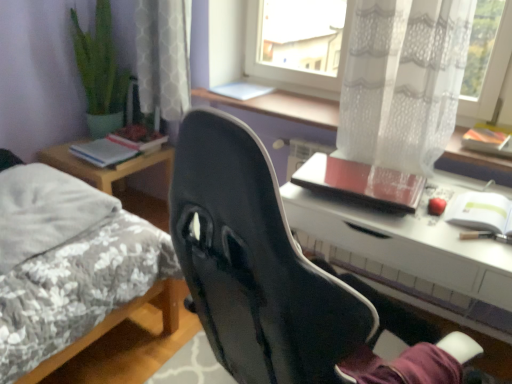
Question: Is point (484, 132) positioned closer to the camera than point (484, 211)?

Choices:
 (A) closer
 (B) farther

Answer: (B)

Question: Considering their positions, is orange matte notebook at upper right, which ranks as the 3th notebook in left-to-right order, located in front of or behind white paper notebook at right, which is counted as the second notebook, starting from the right?

Choices:
 (A) front
 (B) behind

Answer: (B)

Question: Which object is positioned farthest from the white glossy desk at center?

Choices:
 (A) white paper notebook at right, which is counted as the second notebook, starting from the left
 (B) orange matte notebook at upper right, which ranks as the 1th notebook in right-to-left order
 (C) hardcover book at left, which is counted as the first book, starting from the back
 (D) transparent lace curtain at upper center
 (E) hardcover book at left, the second book when ordered from back to front

Answer: (C)

Question: Estimate the real-world distances between objects in this image. Which object is farther from the black matte chair at center?

Choices:
 (A) white lace curtain at upper center, which is the first curtain in back-to-front order
 (B) fluffy gray bed at left
 (C) white paper notebook at right, which is counted as the second notebook, starting from the right
 (D) hardcover book at left, which is the second book in front-to-back order
 (E) white glossy desk at center

Answer: (D)